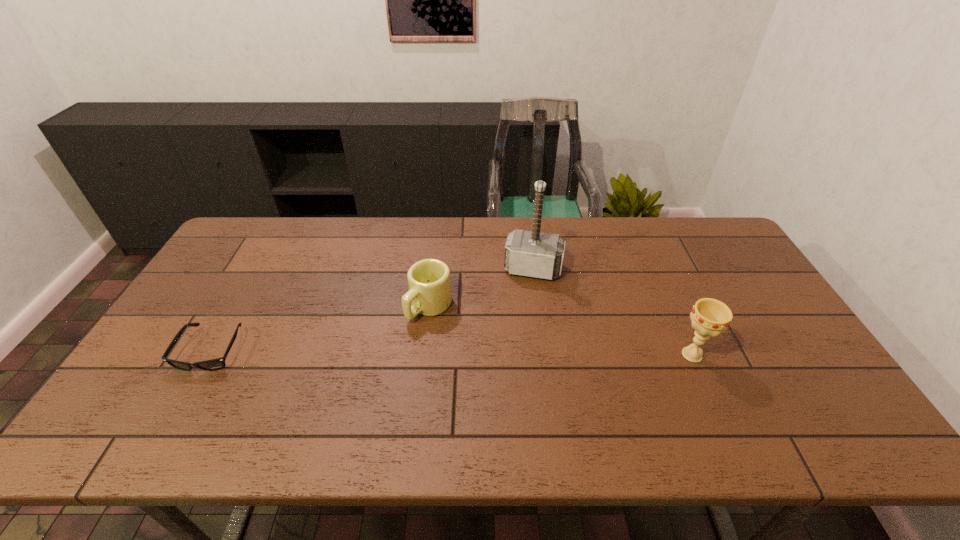
I want to click on vacant space at the left edge of the desktop, so click(246, 293).

The image size is (960, 540). Identify the location of vacant space at the right edge of the desktop. (760, 337).

In the image, there is a desktop. Identify the location of vacant space at the far left corner. The width and height of the screenshot is (960, 540). coord(236,241).

Find the location of a particular element. The height and width of the screenshot is (540, 960). vacant space in between the tallest object and the sunglasses is located at coordinates (372, 310).

The image size is (960, 540). I want to click on free spot between the chalice and the hammer, so click(x=612, y=312).

I want to click on vacant point located between the third nearest object and the sunglasses, so click(x=321, y=328).

The width and height of the screenshot is (960, 540). What are the coordinates of `vacant space that's between the sunglasses and the farthest object` in the screenshot? It's located at (372, 310).

Locate an element on the screen. Image resolution: width=960 pixels, height=540 pixels. vacant region between the third tallest object and the hammer is located at coordinates (481, 288).

Find the location of a particular element. The height and width of the screenshot is (540, 960). vacant space that is in between the farthest object and the second shortest object is located at coordinates point(481,288).

Find the location of a particular element. free space between the second farthest object and the hammer is located at coordinates click(481, 288).